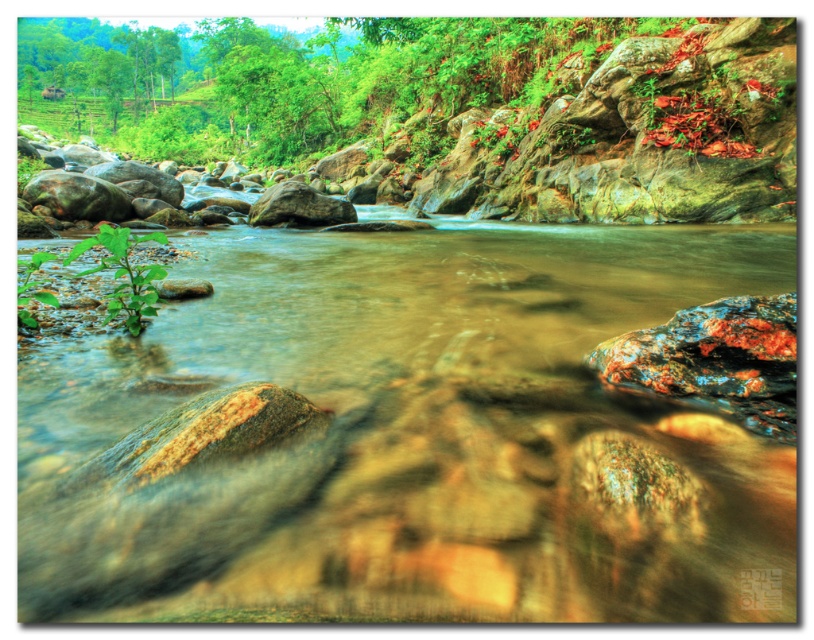
You are standing at the point marked by the coordinates point (125, 275) in the scene. Looking around, you notice a green leafy plant at left. Which direction should you face to see the green leafy plant at left?

Since you are standing at the point marked by the coordinates point (125, 275), which represents the green leafy plant at left, you are already at the location of the plant. To see it, you would need to look down or around your immediate area where the plant is located.

You are standing at the point labeled point (82, 250) and want to reach the other side of the river. The river is 6.69 feet wide at this point. If your inflatable boat can carry a maximum load of 200 pounds, and you weigh 180 pounds, can you safely cross the river with your gear weighing 25 pounds?

The distance between the points is 6.69 feet, but your total weight with gear is 205 pounds, which exceeds the boat capacity of 200 pounds. You cannot safely cross.

You are standing in the natural scene and notice two green leafy plants. One is labeled as the green leafy plant at left and the other as the green leafy plant at lower left. Which of these two plants takes up more area in the image?

The green leafy plant at lower left occupies more space than the green leafy plant at left.